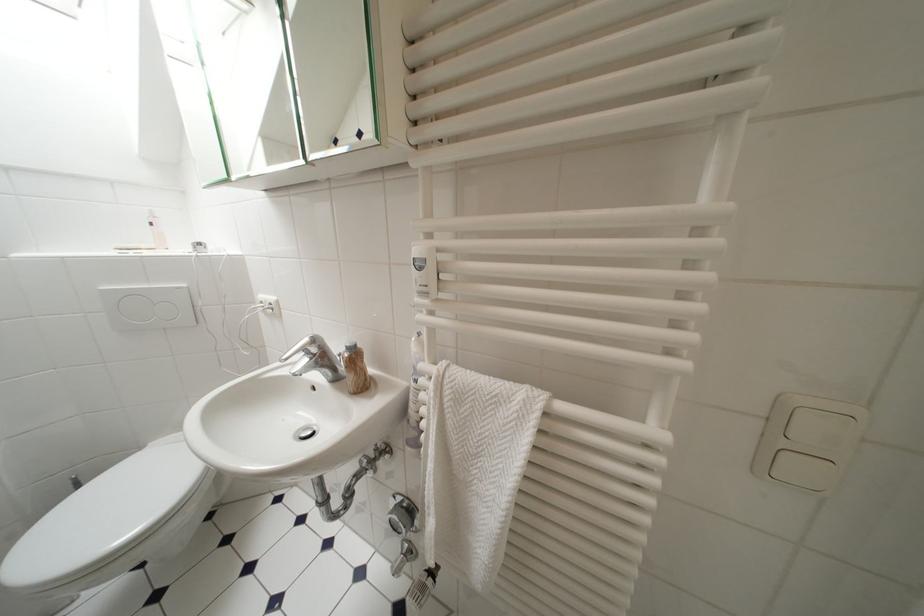
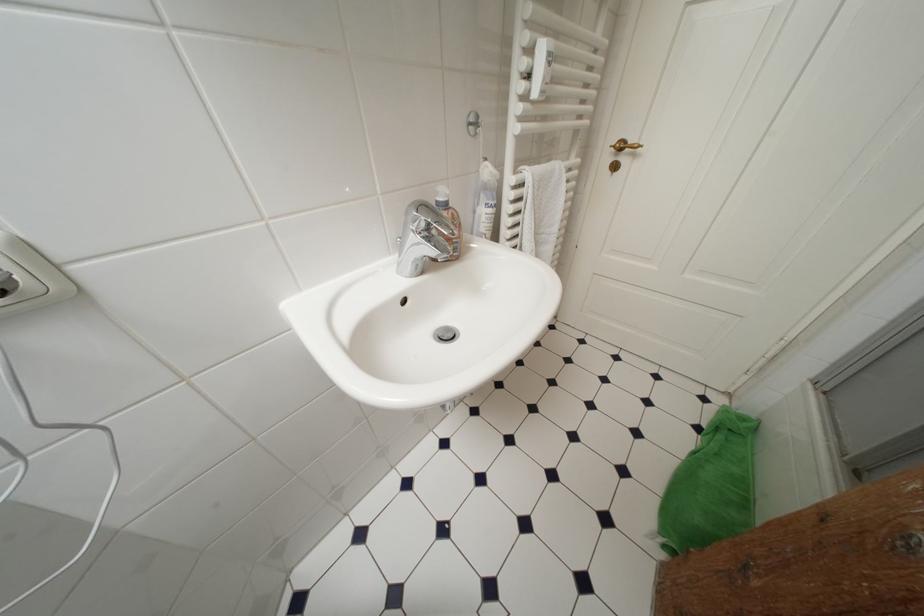
Based on the continuous images, in which direction is the camera rotating?

The camera's rotation is toward right-down.